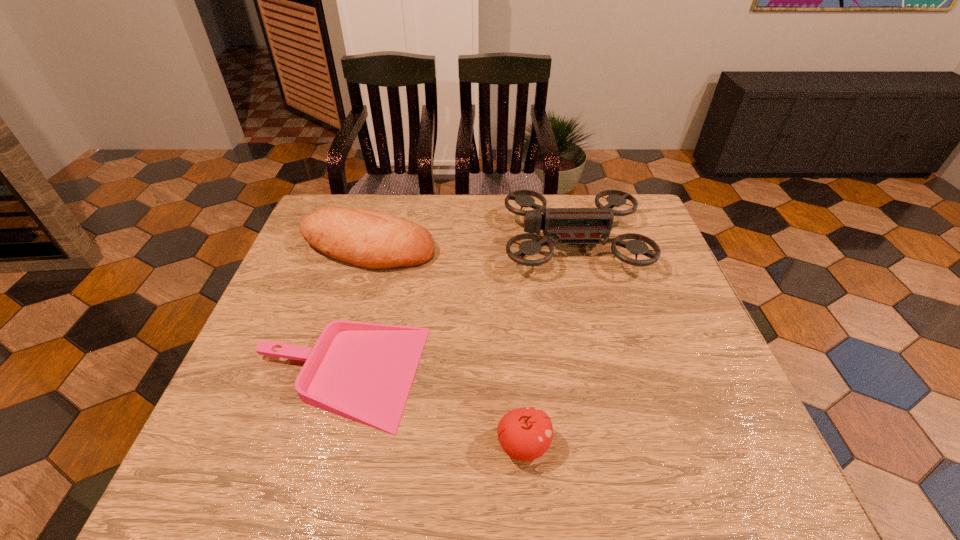
This screenshot has width=960, height=540. I want to click on drone, so click(x=573, y=226).

Find the location of a particular element. The height and width of the screenshot is (540, 960). bread is located at coordinates (370, 239).

Identify the location of apple. (525, 434).

You are a GUI agent. You are given a task and a screenshot of the screen. Output one action in this format:
    pyautogui.click(x=<x>, y=<y>)
    Task: Click on the dustpan
    
    Given the screenshot: What is the action you would take?
    coord(361,371)

Find the location of `vacant region located on the front-facing side of the drone`. vacant region located on the front-facing side of the drone is located at coordinates (402, 243).

You are a GUI agent. You are given a task and a screenshot of the screen. Output one action in this format:
    pyautogui.click(x=<x>, y=<y>)
    Task: Click on the vacant area located 0.210m on the front-facing side of the drone
    The width and height of the screenshot is (960, 540).
    Given the screenshot: What is the action you would take?
    pyautogui.click(x=433, y=243)

This screenshot has width=960, height=540. Find the location of `free region located on the front-facing side of the drone`. free region located on the front-facing side of the drone is located at coordinates (382, 243).

Identify the location of vacant area situated 0.070m on the back of the bread. This screenshot has width=960, height=540. (378, 213).

This screenshot has height=540, width=960. Find the location of `free region located on the right of the apple`. free region located on the right of the apple is located at coordinates (607, 445).

The height and width of the screenshot is (540, 960). In order to click on drone present at the far edge in this screenshot , I will do `click(573, 226)`.